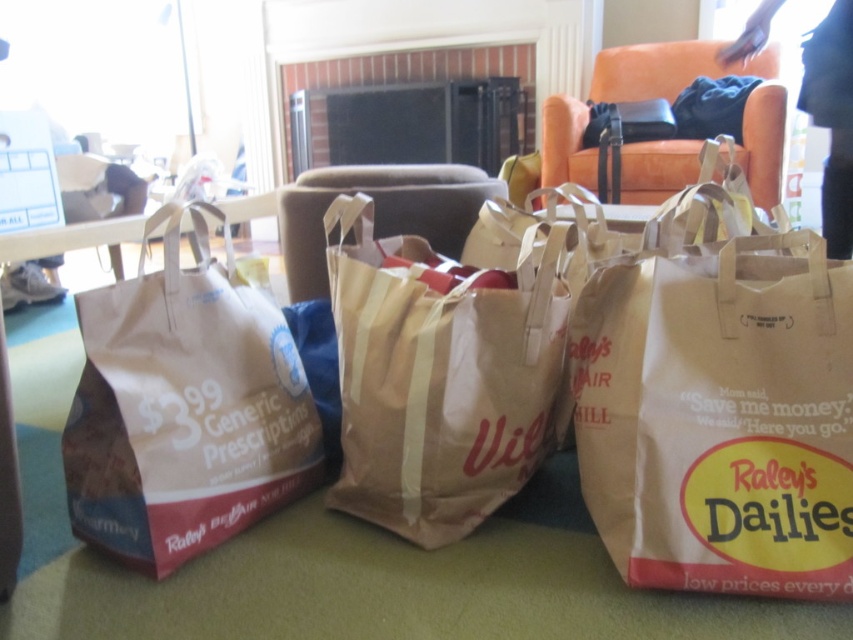
Does brown paper bag at left have a larger size compared to brown paper bag at center?

Actually, brown paper bag at left might be smaller than brown paper bag at center.

Identify the location of brown paper bag at left. This screenshot has width=853, height=640. (184, 404).